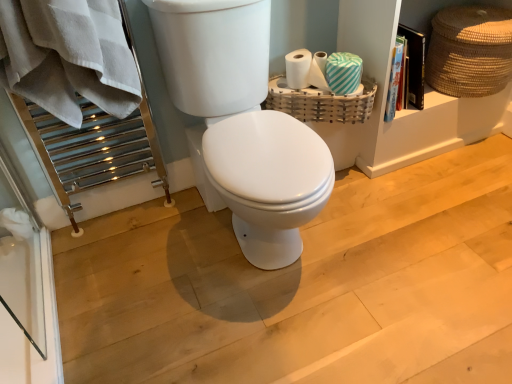
The height and width of the screenshot is (384, 512). Identify the location of free point below white cotton bath towel at left (from a real-world perspective). (92, 247).